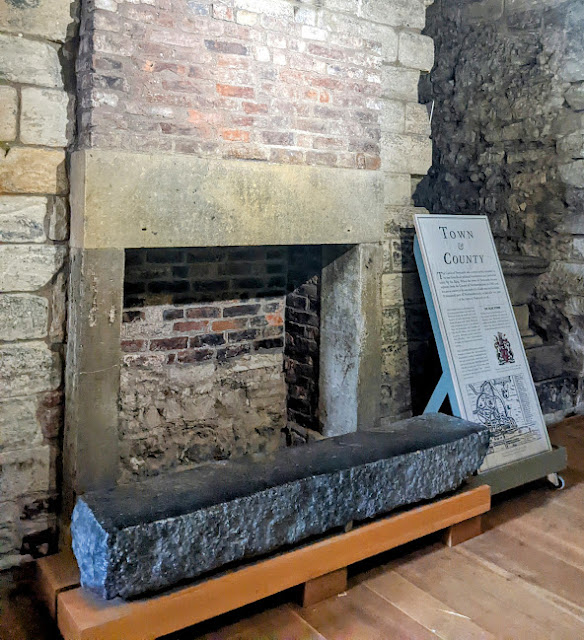
Where is `the left side of fireplace`? This screenshot has height=640, width=584. the left side of fireplace is located at coordinates (368, 340).